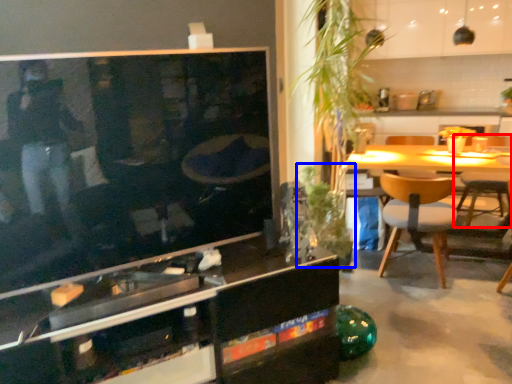
Question: Which point is closer to the camera, chair (highlighted by a red box) or plant (highlighted by a blue box)?

Choices:
 (A) chair
 (B) plant

Answer: (B)